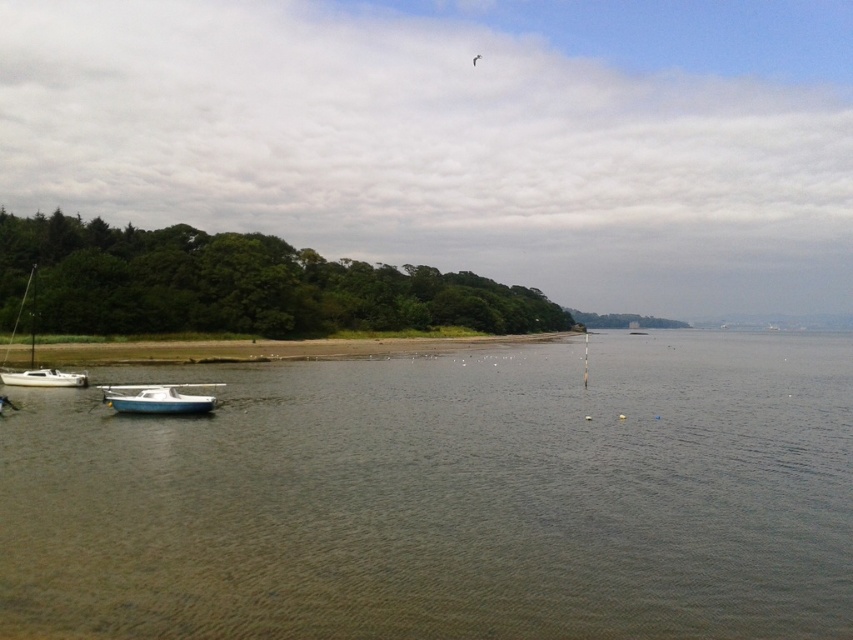
You are standing on the beach and see both the white plastic boat at lower left and the white matte boat at lower left. Which boat is closer to you?

The white plastic boat at lower left is closer to you because it is positioned in front of the white matte boat at lower left.

You are standing at the edge of the beach and want to place a small flag exactly where the brown sand at lower center is located. According to the coordinates provided, where should you place the flag?

You should place the flag at the coordinates point (x=265, y=348) where the brown sand at lower center is located.

You are standing on the beach and see two boats anchored near the shore. Which boat is positioned to the right of the other? The boats are the white plastic boat at lower left and the white matte boat at lower left.

The white plastic boat at lower left is positioned to the right of the white matte boat at lower left.